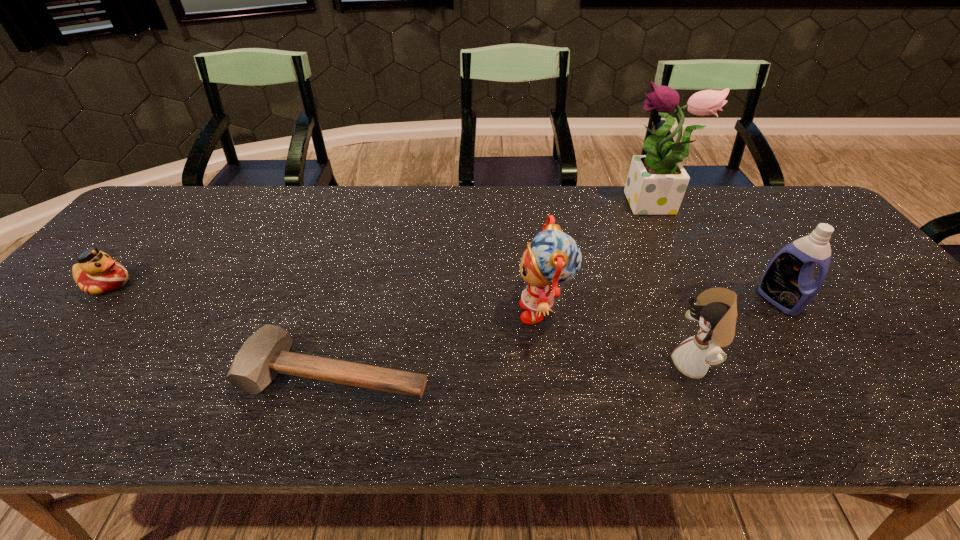
Locate which object ranks in proximity to the detergent. Please provide its 2D coordinates. Your answer should be formatted as a tuple, i.e. [(x, y)], where the tuple contains the x and y coordinates of a point satisfying the conditions above.

[(715, 309)]

This screenshot has width=960, height=540. I want to click on blank space that satisfies the following two spatial constraints: 1. on the back side of the mallet; 2. on the face of the leftmost object, so click(361, 284).

Locate an element on the screen. free location that satisfies the following two spatial constraints: 1. on the front-facing side of the tallest object; 2. on the left side of the detergent is located at coordinates (699, 300).

Where is `vacant area that satisfies the following two spatial constraints: 1. on the face of the detergent; 2. on the left side of the leftmost object`? Image resolution: width=960 pixels, height=540 pixels. vacant area that satisfies the following two spatial constraints: 1. on the face of the detergent; 2. on the left side of the leftmost object is located at coordinates (94, 300).

This screenshot has width=960, height=540. I want to click on vacant space that satisfies the following two spatial constraints: 1. on the face of the detergent; 2. on the right side of the duck, so click(x=94, y=300).

This screenshot has height=540, width=960. What are the coordinates of `free space in the image that satisfies the following two spatial constraints: 1. on the back side of the mallet; 2. on the face of the second shortest object` in the screenshot? It's located at (361, 284).

Where is `vacant space that satisfies the following two spatial constraints: 1. on the face of the shortest object; 2. on the left side of the leftmost object`? This screenshot has height=540, width=960. vacant space that satisfies the following two spatial constraints: 1. on the face of the shortest object; 2. on the left side of the leftmost object is located at coordinates (33, 372).